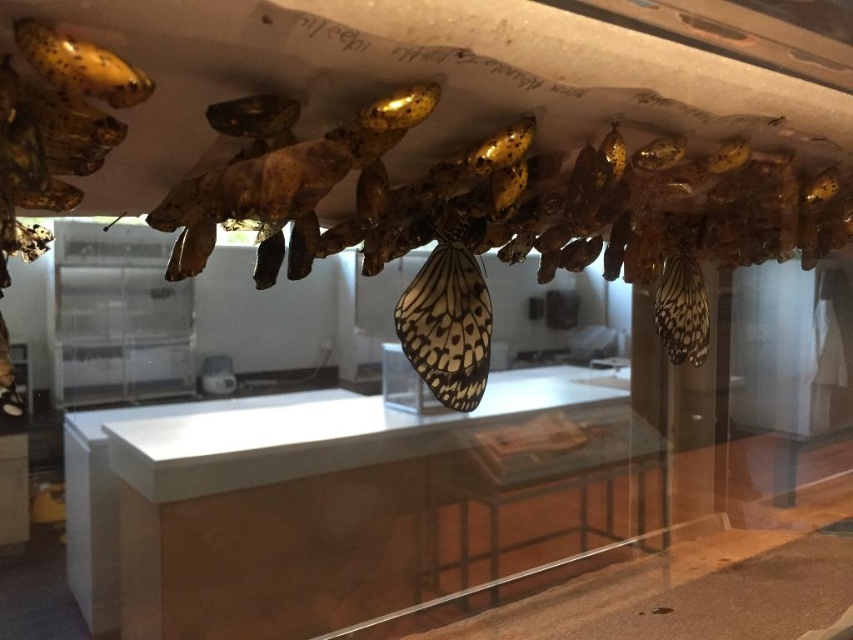
Does white glossy counter top at center have a greater height compared to translucent white butterfly at center?

Yes, white glossy counter top at center is taller than translucent white butterfly at center.

Which is in front, point (140, 422) or point (677, 320)?

Point (677, 320) is in front.

Locate an element on the screen. white glossy counter top at center is located at coordinates (344, 502).

The height and width of the screenshot is (640, 853). I want to click on white glossy counter top at center, so click(344, 502).

The image size is (853, 640). What are the coordinates of `white glossy counter top at center` in the screenshot? It's located at (344, 502).

Find the location of a particular element. This screenshot has width=853, height=640. white glossy counter top at center is located at coordinates (344, 502).

Between patterned paper butterfly at center and translucent white butterfly at center, which one has less height?

translucent white butterfly at center is shorter.

Is point (476, 397) positioned after point (675, 316)?

No, (476, 397) is closer to viewer.

Describe the element at coordinates (448, 316) in the screenshot. I see `patterned paper butterfly at center` at that location.

Where is `patterned paper butterfly at center`? The image size is (853, 640). patterned paper butterfly at center is located at coordinates (448, 316).